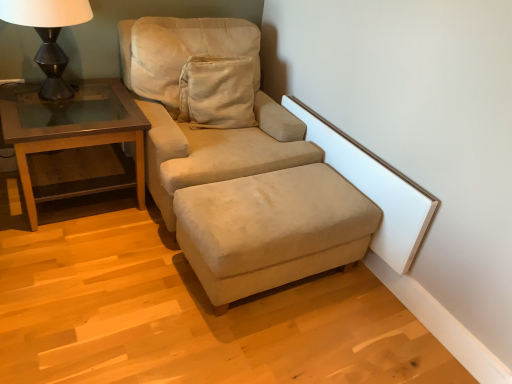
Question: Is suede beige studio couch at center shorter than matte black lamp at left?

Choices:
 (A) yes
 (B) no

Answer: (B)

Question: Is suede beige studio couch at center closer to camera compared to matte black lamp at left?

Choices:
 (A) yes
 (B) no

Answer: (A)

Question: Can we say suede beige studio couch at center lies outside matte black lamp at left?

Choices:
 (A) yes
 (B) no

Answer: (A)

Question: Would you consider suede beige studio couch at center to be distant from matte black lamp at left?

Choices:
 (A) no
 (B) yes

Answer: (A)

Question: From a real-world perspective, is suede beige studio couch at center below matte black lamp at left?

Choices:
 (A) no
 (B) yes

Answer: (B)

Question: Considering the positions of point (132, 34) and point (42, 3), is point (132, 34) closer or farther from the camera than point (42, 3)?

Choices:
 (A) closer
 (B) farther

Answer: (B)

Question: Is suede beige studio couch at center to the left or to the right of matte black lamp at left in the image?

Choices:
 (A) right
 (B) left

Answer: (A)

Question: From the image's perspective, is suede beige studio couch at center positioned above or below matte black lamp at left?

Choices:
 (A) below
 (B) above

Answer: (A)

Question: Is suede beige studio couch at center wider or thinner than matte black lamp at left?

Choices:
 (A) thin
 (B) wide

Answer: (B)

Question: Would you say suede beige studio couch at center is to the left or to the right of beige suede ottoman at lower center in the picture?

Choices:
 (A) right
 (B) left

Answer: (B)

Question: From a real-world perspective, relative to beige suede ottoman at lower center, is suede beige studio couch at center vertically above or below?

Choices:
 (A) above
 (B) below

Answer: (A)

Question: Relative to beige suede ottoman at lower center, is suede beige studio couch at center in front or behind?

Choices:
 (A) front
 (B) behind

Answer: (B)

Question: From the image's perspective, is suede beige studio couch at center located above or below beige suede ottoman at lower center?

Choices:
 (A) below
 (B) above

Answer: (B)

Question: From the image's perspective, is beige suede ottoman at lower center located above or below suede beige studio couch at center?

Choices:
 (A) below
 (B) above

Answer: (A)

Question: Is beige suede ottoman at lower center to the left or to the right of suede beige studio couch at center in the image?

Choices:
 (A) right
 (B) left

Answer: (A)